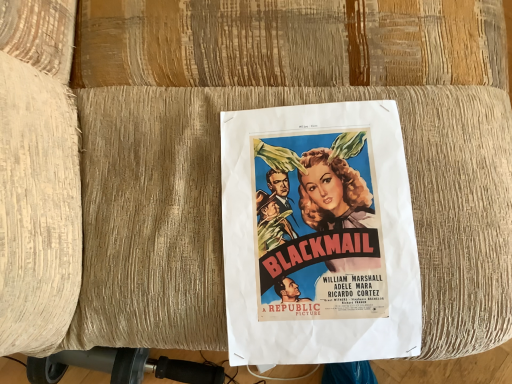
Find the location of a particular element. vacant point above vintage paper poster at center (from a real-world perspective) is located at coordinates (324, 231).